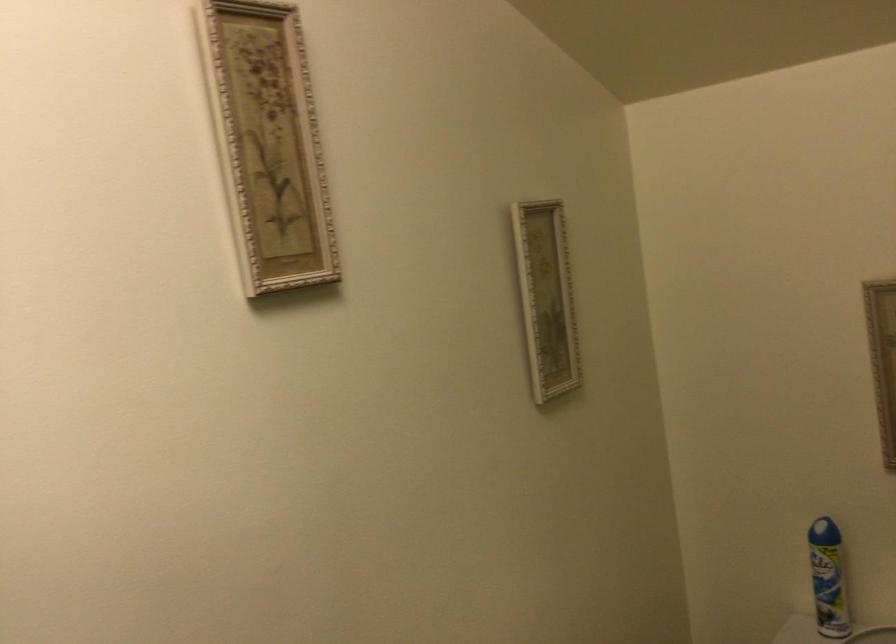
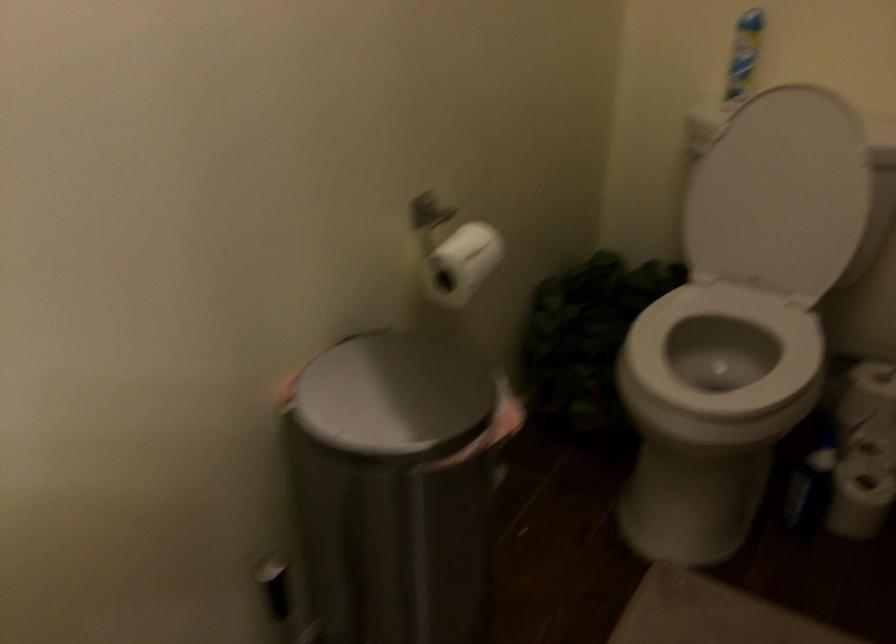
In a continuous first-person perspective shot, in which direction is the camera moving?

The movement direction of the cameraman is left, backward.